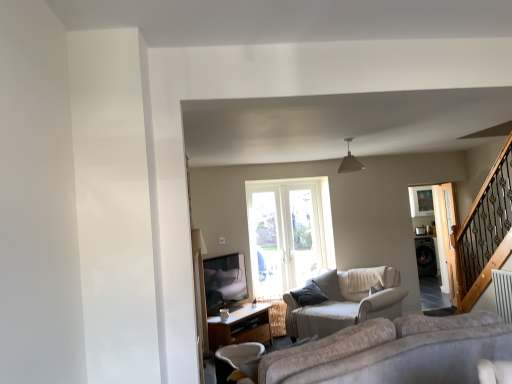
Question: Does black glossy washing machine at right have a smaller size compared to white fabric chair at lower center?

Choices:
 (A) yes
 (B) no

Answer: (B)

Question: Could you tell me if black glossy washing machine at right is facing white fabric chair at lower center?

Choices:
 (A) no
 (B) yes

Answer: (A)

Question: Is black glossy washing machine at right turned away from white fabric chair at lower center?

Choices:
 (A) no
 (B) yes

Answer: (A)

Question: Is black glossy washing machine at right not inside white fabric chair at lower center?

Choices:
 (A) yes
 (B) no

Answer: (A)

Question: Can you confirm if black glossy washing machine at right is taller than white fabric chair at lower center?

Choices:
 (A) yes
 (B) no

Answer: (A)

Question: Considering the relative positions of clear glass screen door at right, the 1th screen door when ordered from back to front, and clear glass screen door at right, which appears as the first screen door when viewed from the front, in the image provided, is clear glass screen door at right, the 1th screen door when ordered from back to front, to the left or to the right of clear glass screen door at right, which appears as the first screen door when viewed from the front,?

Choices:
 (A) left
 (B) right

Answer: (A)

Question: In the image, is clear glass screen door at right, acting as the 2th screen door starting from the front, positioned in front of or behind clear glass screen door at right, which appears as the first screen door when viewed from the front?

Choices:
 (A) front
 (B) behind

Answer: (B)

Question: Is clear glass screen door at right, acting as the 2th screen door starting from the front, bigger or smaller than clear glass screen door at right, which appears as the first screen door when viewed from the front?

Choices:
 (A) big
 (B) small

Answer: (B)

Question: From the image's perspective, is clear glass screen door at right, the 1th screen door when ordered from back to front, above or below clear glass screen door at right, which appears as the first screen door when viewed from the front?

Choices:
 (A) above
 (B) below

Answer: (B)

Question: Considering the positions of wooden table at lower center and clear glass screen door at right, which appears as the first screen door when viewed from the front, in the image, is wooden table at lower center bigger or smaller than clear glass screen door at right, which appears as the first screen door when viewed from the front,?

Choices:
 (A) small
 (B) big

Answer: (B)

Question: Considering the relative positions of wooden table at lower center and clear glass screen door at right, which appears as the first screen door when viewed from the front, in the image provided, is wooden table at lower center to the left or to the right of clear glass screen door at right, which appears as the first screen door when viewed from the front,?

Choices:
 (A) right
 (B) left

Answer: (B)

Question: Is point (206, 321) positioned closer to the camera than point (445, 233)?

Choices:
 (A) farther
 (B) closer

Answer: (B)

Question: From the image's perspective, is wooden table at lower center above or below clear glass screen door at right, the second screen door positioned from the back?

Choices:
 (A) above
 (B) below

Answer: (B)

Question: Is beige fabric studio couch at center situated inside clear glass screen door at right, the second screen door positioned from the back, or outside?

Choices:
 (A) outside
 (B) inside

Answer: (A)

Question: Considering their positions, is beige fabric studio couch at center located in front of or behind clear glass screen door at right, which appears as the first screen door when viewed from the front?

Choices:
 (A) front
 (B) behind

Answer: (A)